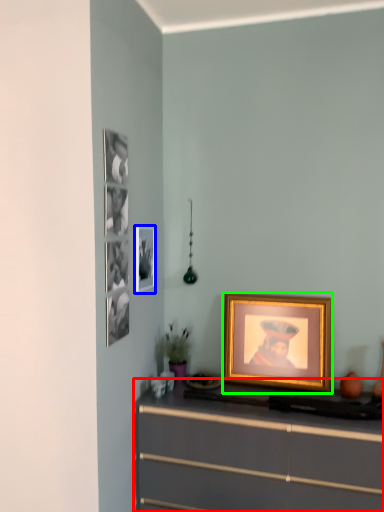
Question: Based on their relative distances, which object is nearer to chest of drawers (highlighted by a red box)? Choose from picture frame (highlighted by a blue box) and picture frame (highlighted by a green box).

Choices:
 (A) picture frame
 (B) picture frame

Answer: (B)